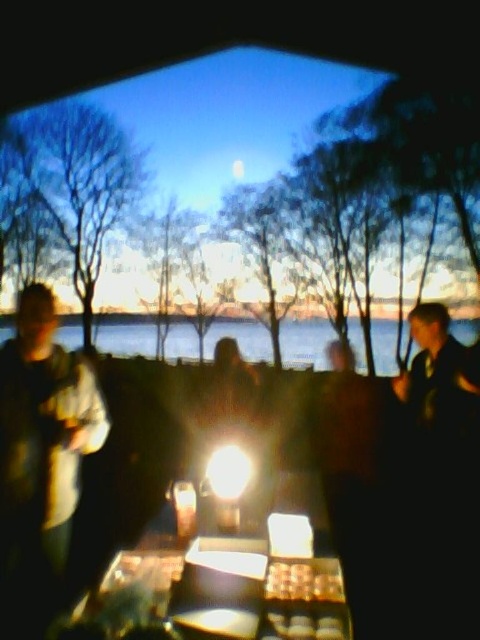
You are a photographer trying to capture the golden brown pastry at center while standing near the dark blue shirt at right. Since you want to focus on the pastry, which object should you move closer to or farther from the camera?

To focus on the golden brown pastry at center, you should move closer to the pastry or move farther from the dark blue shirt at right since the dark blue shirt at right is bigger than the pastry. However, since the dark blue shirt at right is larger, moving closer to the pastry would help in focusing on it while keeping the shirt in frame.

You are standing in the twilight scene and want to move from the point closer to you to the farther point. Which path would you take between the two points, point (101, 592) and point (336, 596)?

The path from point (101, 592) to point (336, 596) would involve moving forward and slightly upward since point (101, 592) is closer to the viewer than point (336, 596).

You are a food vendor at the twilight market. A customer wearing a dark blue shirt at right wants to grab a golden brown pastry at center. Can they reach it without moving from their current position?

The dark blue shirt at right and golden brown pastry at center are 5.16 feet apart. Since the distance is greater than an average person can reach, the customer would need to move closer to grab the pastry.